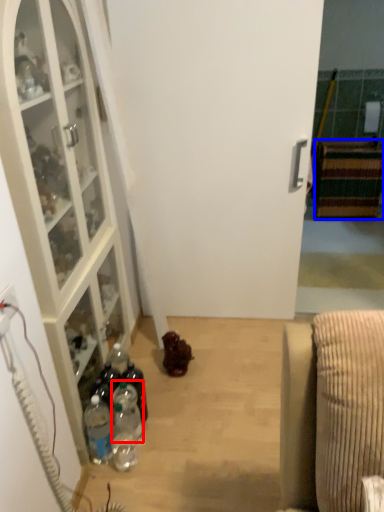
Question: Which object is closer to the camera taking this photo, bottle (highlighted by a red box) or cabinetry (highlighted by a blue box)?

Choices:
 (A) bottle
 (B) cabinetry

Answer: (A)